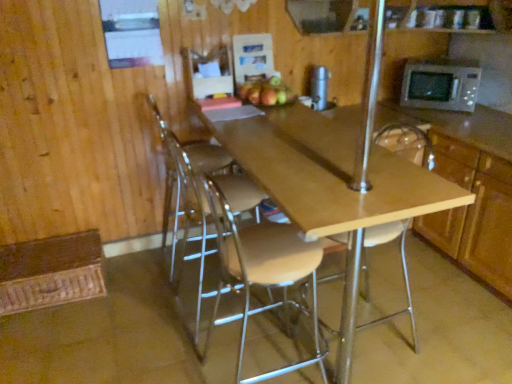
Question: Is silver metallic thermos at upper center bigger or smaller than matte brown apple at center?

Choices:
 (A) small
 (B) big

Answer: (A)

Question: Is silver metallic thermos at upper center in front of or behind matte brown apple at center in the image?

Choices:
 (A) behind
 (B) front

Answer: (A)

Question: Considering the real-world distances, which object is closest to the wooden cabinet at right?

Choices:
 (A) silver metallic microwave at upper right
 (B) wooden seat at center, placed as the 3th chair when sorted from left to right
 (C) clear plastic chair at center, which is the third chair from right to left
 (D) light brown wood stool at center, positioned as the 2th chair in right-to-left order
 (E) light wood/matte table at center

Answer: (B)

Question: Which is nearer to the light wood/matte table at center?

Choices:
 (A) matte brown apple at center
 (B) wooden cabinet at right
 (C) clear plastic chair at center, which is the third chair from right to left
 (D) silver metallic microwave at upper right
 (E) brown woven mat at lower left

Answer: (C)